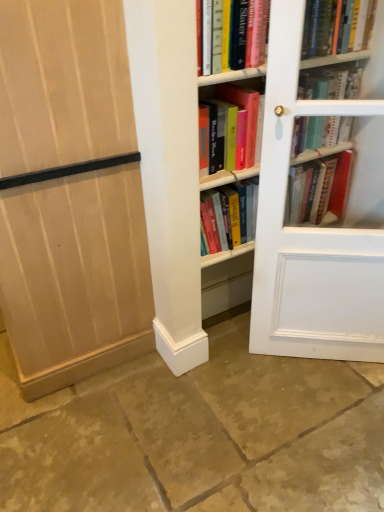
Question: From the image's perspective, is white glass door at right above or below hardcover book at center, which appears as the first book when viewed from the right?

Choices:
 (A) below
 (B) above

Answer: (A)

Question: In the image, is white glass door at right on the left side or the right side of hardcover book at center, placed as the 3th book when sorted from left to right?

Choices:
 (A) left
 (B) right

Answer: (B)

Question: Considering the real-world distances, which object is farthest from the white glass door at right?

Choices:
 (A) light wood paneling at left
 (B) hardcover book at upper right, placed as the second book when sorted from left to right
 (C) hardcover book at center, which appears as the first book when viewed from the right
 (D) hardcover book at upper center, positioned as the third book in right-to-left order
 (E) brown stone floor at lower center

Answer: (B)

Question: Estimate the real-world distances between objects in this image. Which object is closer to the white glass door at right?

Choices:
 (A) hardcover book at upper right, which appears as the second book when viewed from the right
 (B) light wood paneling at left
 (C) hardcover book at center, which appears as the first book when viewed from the right
 (D) brown stone floor at lower center
 (E) hardcover book at upper center, positioned as the third book in right-to-left order

Answer: (B)